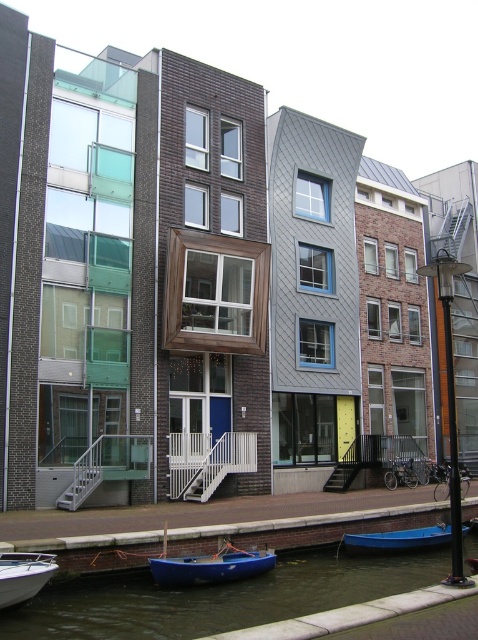
Which of these two, dark blue water at lower center or white fiberglass boat at lower left, stands taller?

With more height is dark blue water at lower center.

Does dark blue water at lower center appear on the left side of white fiberglass boat at lower left?

Incorrect, dark blue water at lower center is not on the left side of white fiberglass boat at lower left.

What do you see at coordinates (217, 596) in the screenshot? I see `dark blue water at lower center` at bounding box center [217, 596].

At what (x,y) coordinates should I click in order to perform the action: click on dark blue water at lower center. Please return your answer as a coordinate pair (x, y). Looking at the image, I should click on (217, 596).

Who is shorter, white fiberglass boat at lower left or blue plastic boat at lower center?

With less height is blue plastic boat at lower center.

Describe the element at coordinates (23, 576) in the screenshot. I see `white fiberglass boat at lower left` at that location.

Does point (53, 556) come farther from viewer compared to point (417, 541)?

No, it is in front of (417, 541).

This screenshot has height=640, width=478. Identify the location of white fiberglass boat at lower left. (23, 576).

Who is more forward, (x=270, y=566) or (x=0, y=598)?

Point (x=0, y=598) is more forward.

Does blue matte boat at lower center lie in front of white fiberglass boat at lower left?

No, blue matte boat at lower center is further to the viewer.

Which is in front, point (214, 576) or point (21, 566)?

Point (21, 566)

Identify the location of blue matte boat at lower center. The height and width of the screenshot is (640, 478). (212, 566).